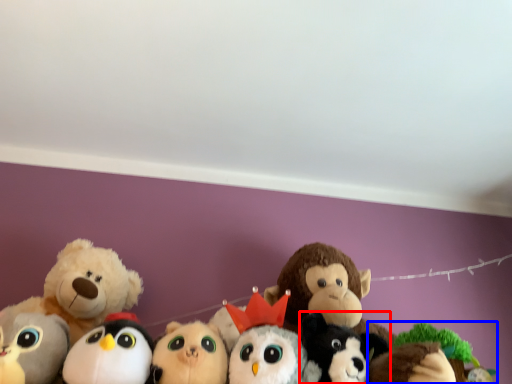
Question: Which point is closer to the camera, toy (highlighted by a red box) or toy (highlighted by a blue box)?

Choices:
 (A) toy
 (B) toy

Answer: (A)